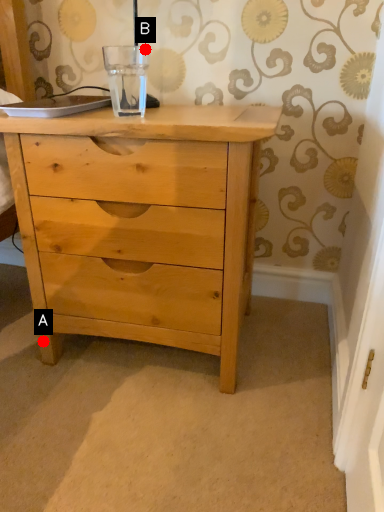
Question: Two points are circled on the image, labeled by A and B beside each circle. Among these points, which one is farthest from the camera?

Choices:
 (A) A is further
 (B) B is further

Answer: (B)